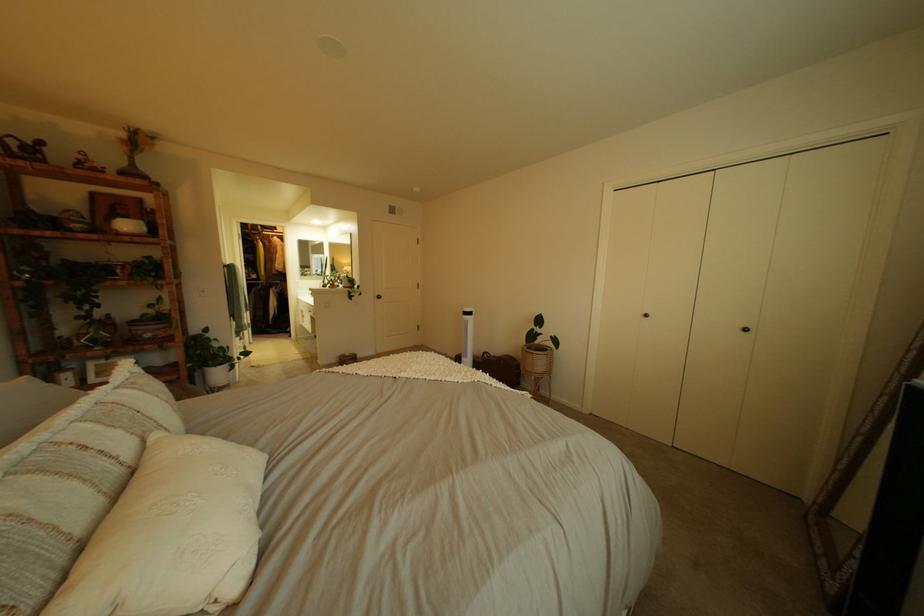
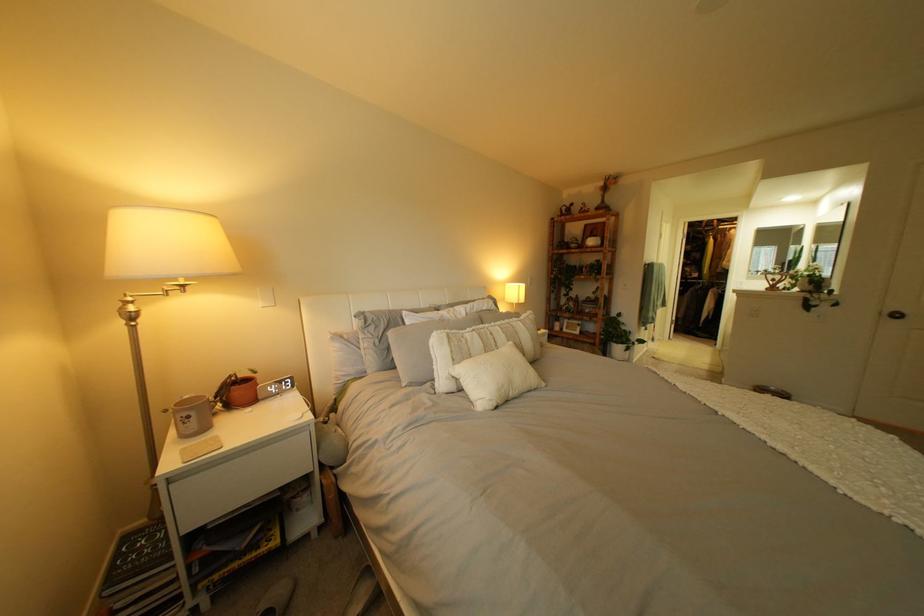
Question: I am providing you with two images of the same scene from different viewpoints. Which of the following objects are not visible in image2?

Choices:
 (A) lamp adjustment knob
 (B) white light switch
 (C) silver door knob
 (D) none of these

Answer: (D)